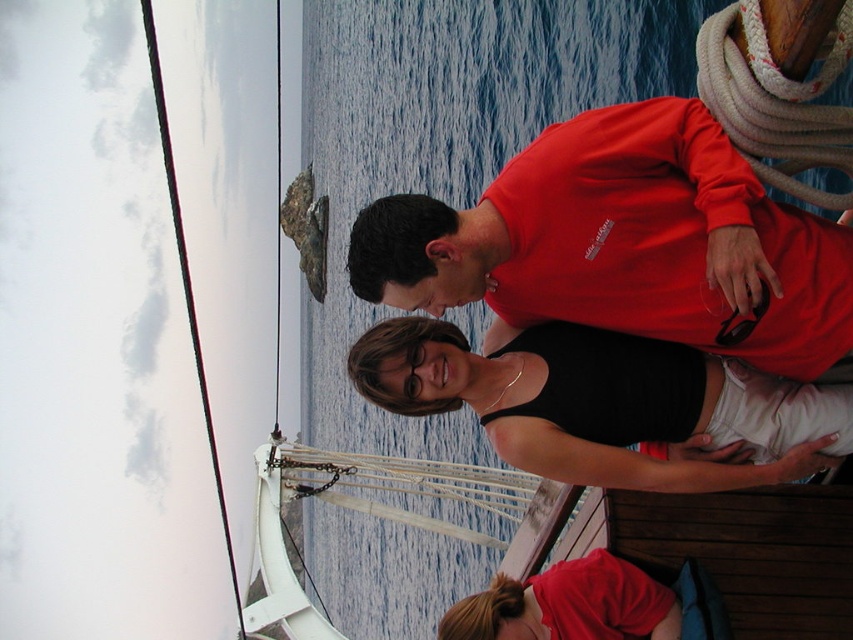
This screenshot has height=640, width=853. What do you see at coordinates (625, 243) in the screenshot?
I see `matte red shirt at center` at bounding box center [625, 243].

The image size is (853, 640). I want to click on matte red shirt at center, so click(x=625, y=243).